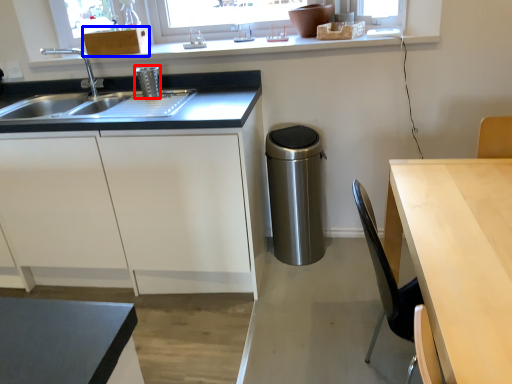
Question: Which of the following is the closest to the observer, appliance (highlighted by a red box) or cabinetry (highlighted by a blue box)?

Choices:
 (A) appliance
 (B) cabinetry

Answer: (A)